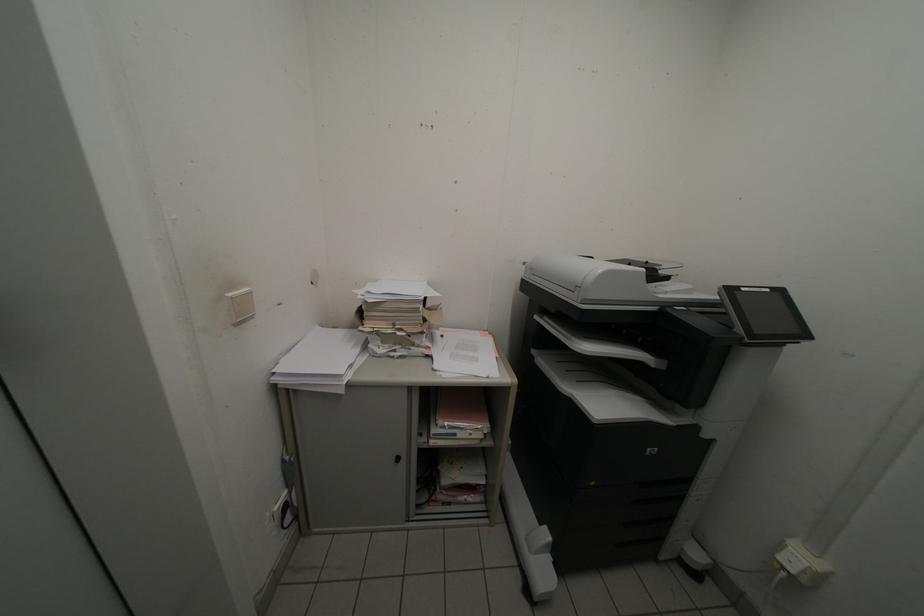
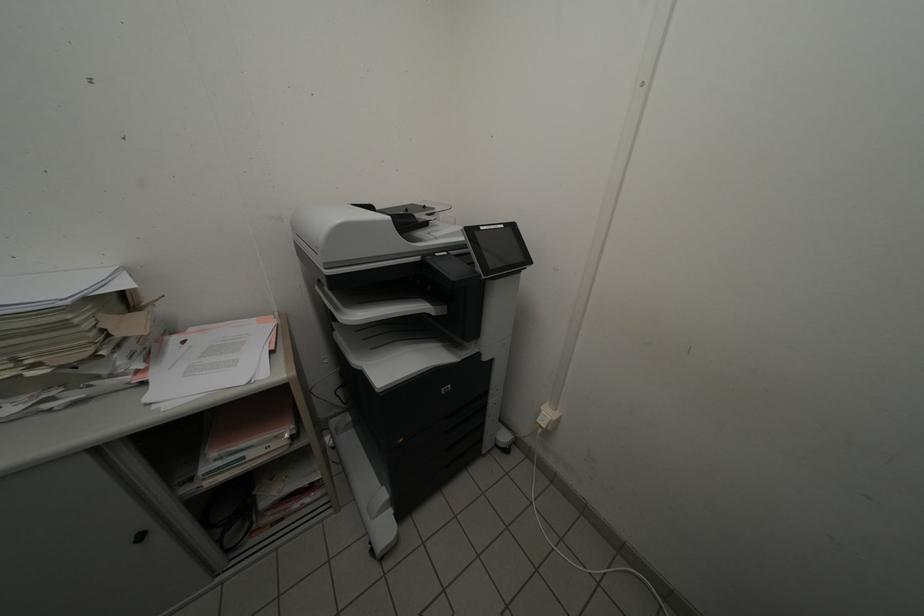
Where in the second image is the point corresponding to point (751, 292) from the first image?

(490, 230)